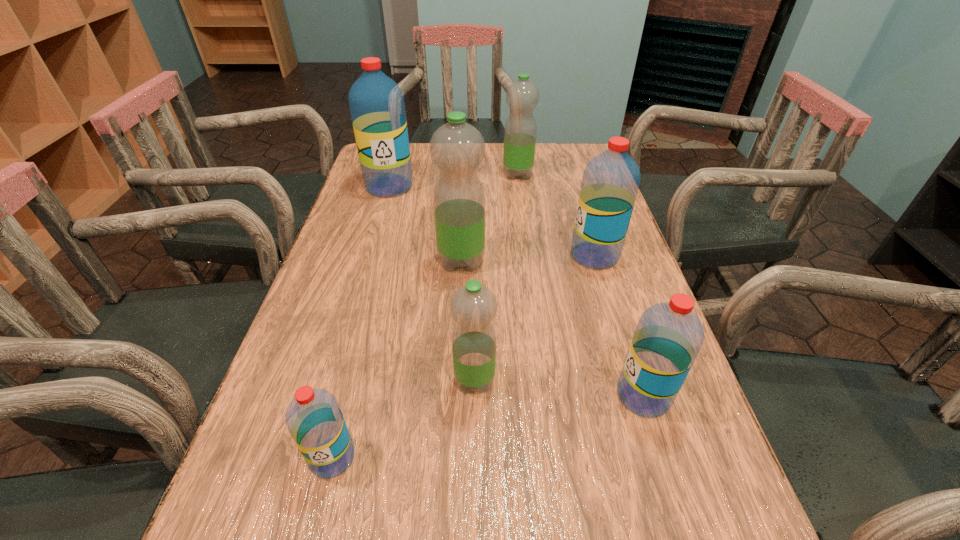
Identify the location of green water bottle that stands as the third closest to the second smallest red water bottle. The image size is (960, 540). (522, 96).

You are a GUI agent. You are given a task and a screenshot of the screen. Output one action in this format:
    pyautogui.click(x=<x>, y=<y>)
    Task: Click on the green water bottle object that ranks as the closest to the shortest object
    The image size is (960, 540).
    Given the screenshot: What is the action you would take?
    pyautogui.click(x=473, y=307)